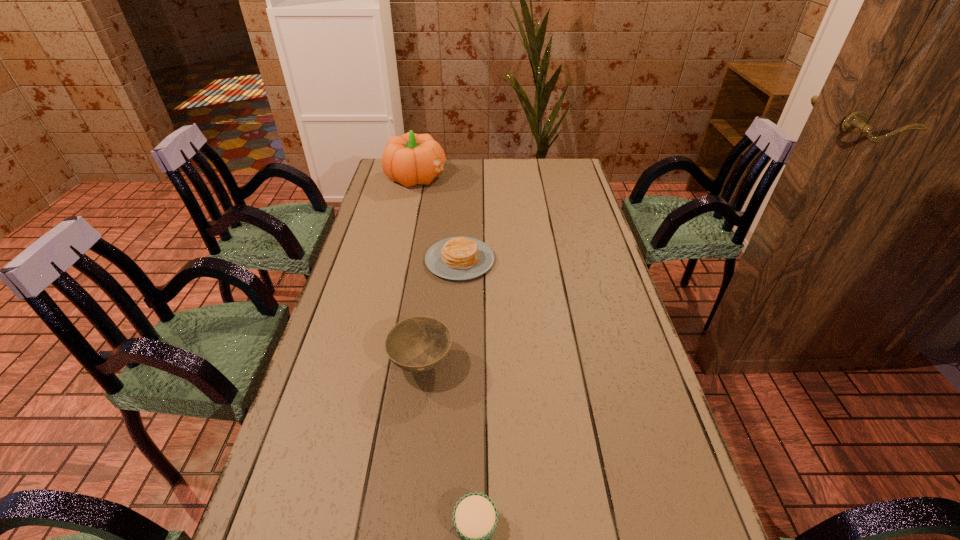
I want to click on the tallest object, so click(x=410, y=159).

Locate an element on the screen. The image size is (960, 540). pumpkin is located at coordinates (410, 159).

Locate an element on the screen. Image resolution: width=960 pixels, height=540 pixels. the third shortest object is located at coordinates (417, 344).

Where is `bowl`? This screenshot has width=960, height=540. bowl is located at coordinates (417, 344).

This screenshot has width=960, height=540. In order to click on pancake in this screenshot , I will do `click(456, 258)`.

Locate an element on the screen. This screenshot has width=960, height=540. the third tallest object is located at coordinates (456, 258).

Locate an element on the screen. The height and width of the screenshot is (540, 960). blank space located on the carved face of the tallest object is located at coordinates (468, 177).

At what (x,y) coordinates should I click in order to perform the action: click on vacant space located 0.360m on the back of the third shortest object. Please return your answer as a coordinate pair (x, y). Looking at the image, I should click on (435, 256).

The image size is (960, 540). I want to click on vacant space located 0.240m on the left of the second shortest object, so click(x=351, y=260).

You are a GUI agent. You are given a task and a screenshot of the screen. Output one action in this format:
    pyautogui.click(x=<x>, y=<y>)
    Task: Click on the object located at the far edge
    
    Given the screenshot: What is the action you would take?
    pyautogui.click(x=410, y=159)